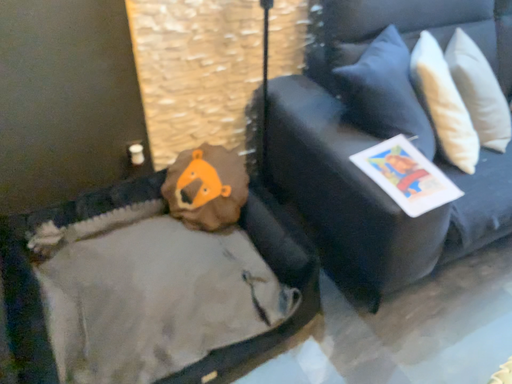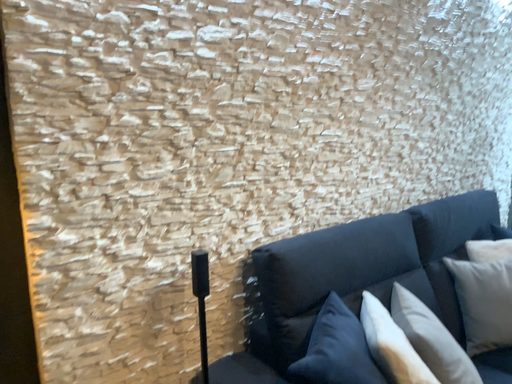
Question: How did the camera likely rotate when shooting the video?

Choices:
 (A) rotated right
 (B) rotated left

Answer: (A)